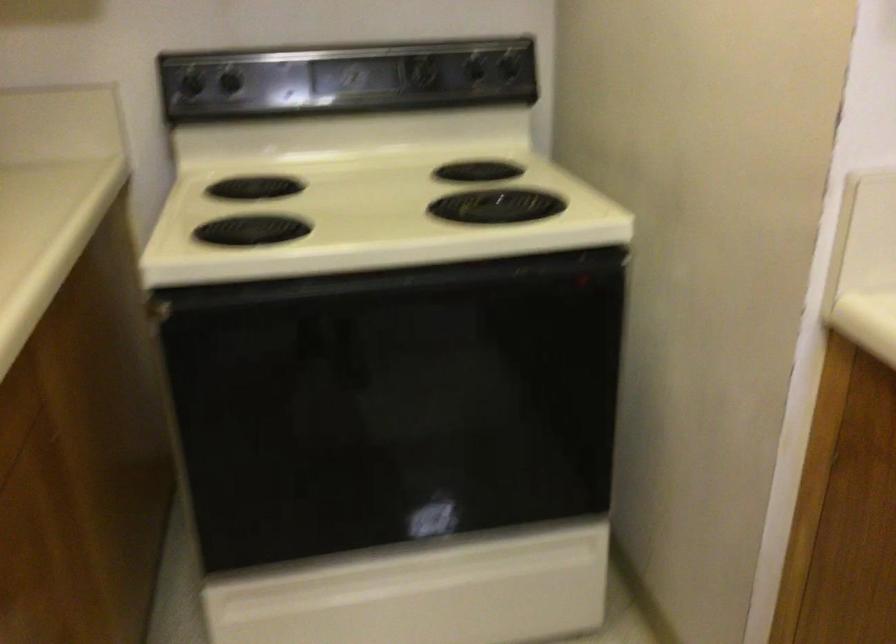
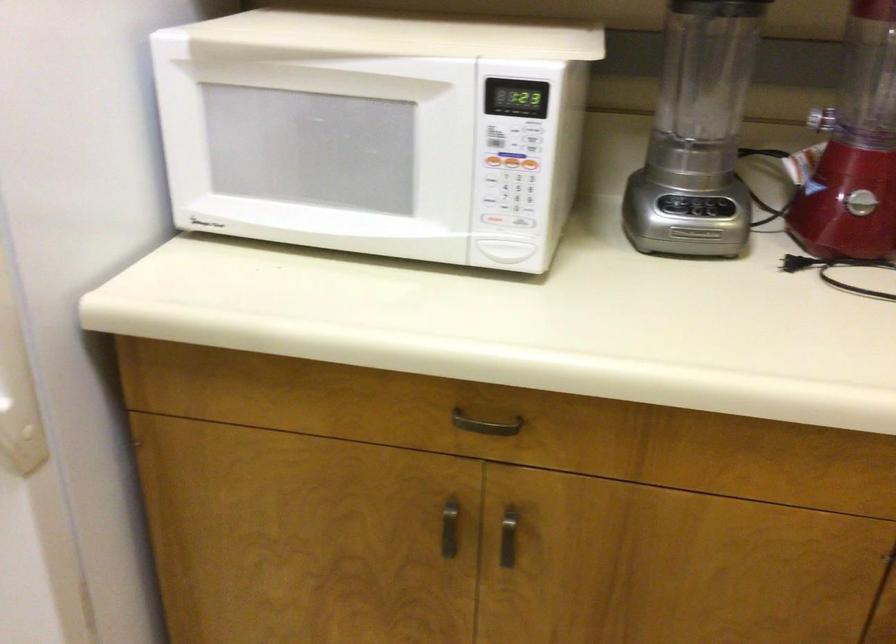
The first image is from the beginning of the video and the second image is from the end. How did the camera likely rotate when shooting the video?

The camera rotated toward left-down.